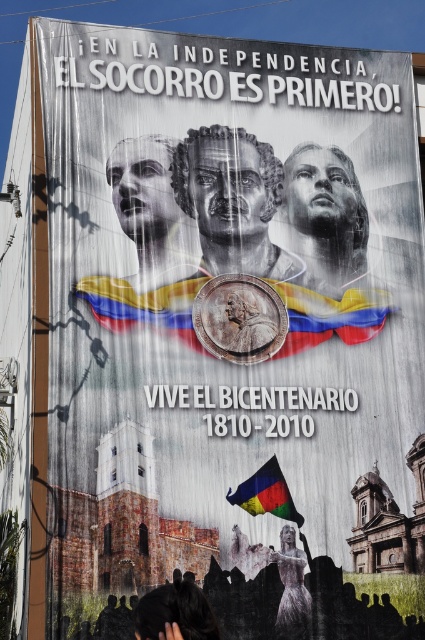
This screenshot has height=640, width=425. In order to click on grayscale sculpture at center in this screenshot , I will do `click(232, 202)`.

Which is behind, point (234, 234) or point (385, 294)?

Point (385, 294)

Between point (175, 172) and point (166, 330), which one is positioned behind?

Point (175, 172)

Where is `grayscale sculpture at center`? The image size is (425, 640). grayscale sculpture at center is located at coordinates (232, 202).

Can you confirm if polished metallic coin at center is thinner than silvery metallic dress at center?

In fact, polished metallic coin at center might be wider than silvery metallic dress at center.

Where is `polished metallic coin at center`? The width and height of the screenshot is (425, 640). polished metallic coin at center is located at coordinates (329, 316).

Identify the location of polished metallic coin at center. (329, 316).

Which is more to the right, polished metallic coin at center or multicolored fabric flag at center?

multicolored fabric flag at center

I want to click on polished metallic coin at center, so [329, 316].